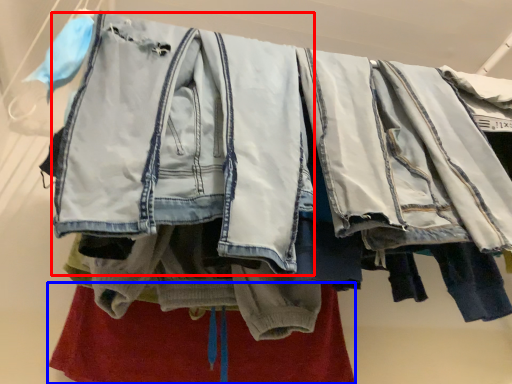
Question: Which object appears closest to the camera in this image, denim jacket (highlighted by a red box) or underclothes (highlighted by a blue box)?

Choices:
 (A) denim jacket
 (B) underclothes

Answer: (A)